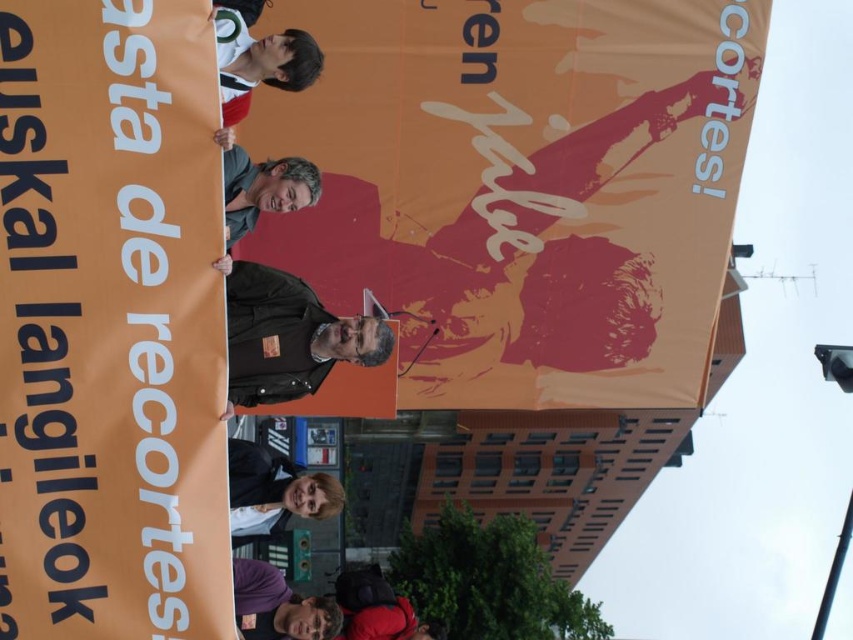
Which is more to the left, green jersey at upper left or matte black jacket at center?

From the viewer's perspective, matte black jacket at center appears more on the left side.

Does point (242, 19) come behind point (250, 182)?

Yes, point (242, 19) is farther from viewer.

Does point (218, 58) lie in front of point (224, 157)?

Yes, point (218, 58) is closer to viewer.

Image resolution: width=853 pixels, height=640 pixels. In order to click on green jersey at upper left in this screenshot , I will do `click(259, 61)`.

Does point (244, 451) lie behind point (289, 177)?

Yes, it is behind point (289, 177).

Is smooth black jacket at lower center positioned before matte black jacket at center?

That is True.

Which is behind, point (267, 452) or point (257, 205)?

Point (267, 452)

You are a GUI agent. You are given a task and a screenshot of the screen. Output one action in this format:
    pyautogui.click(x=<x>, y=<y>)
    Task: Click on the smooth black jacket at lower center
    Image resolution: width=853 pixels, height=640 pixels.
    Given the screenshot: What is the action you would take?
    pyautogui.click(x=274, y=490)

Is orange fabric banner at upper left to the left of black leather jacket at center from the viewer's perspective?

Yes, orange fabric banner at upper left is to the left of black leather jacket at center.

Is orange fabric banner at upper left to the right of black leather jacket at center from the viewer's perspective?

No, orange fabric banner at upper left is not to the right of black leather jacket at center.

Identify the location of orange fabric banner at upper left. The image size is (853, 640). (109, 324).

Locate an element on the screen. The image size is (853, 640). orange fabric banner at upper left is located at coordinates (109, 324).